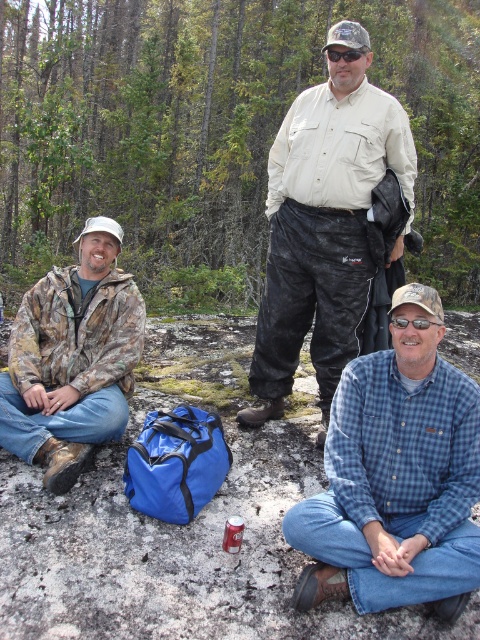
You are a photographer positioned at the camera location. You want to take a photo of the scene, but you need to ensure that the area around point (386, 476) is in focus. What is the minimum focusing distance you should set on your camera to capture this point clearly?

The minimum focusing distance you should set is 2.83 meters because the point (386, 476) is exactly 2.83 meters away from the camera.

You are planning to take a photo of the blue plaid shirt at lower right and the khaki cotton shirt at center. Which one should you focus on first if you want to capture both in the frame without moving the camera?

The blue plaid shirt at lower right has a lesser height compared to khaki cotton shirt at center, so you should focus on the khaki cotton shirt at center first to ensure both are in the frame.